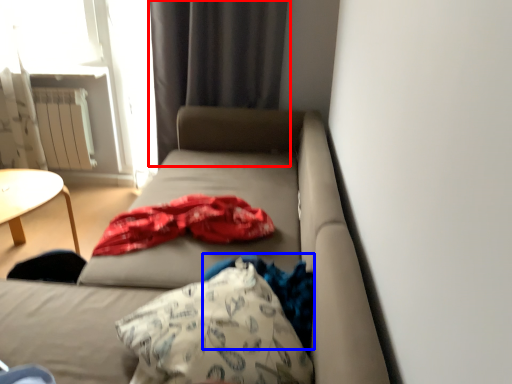
Question: Among these objects, which one is farthest to the camera, curtain (highlighted by a red box) or clothing (highlighted by a blue box)?

Choices:
 (A) curtain
 (B) clothing

Answer: (A)